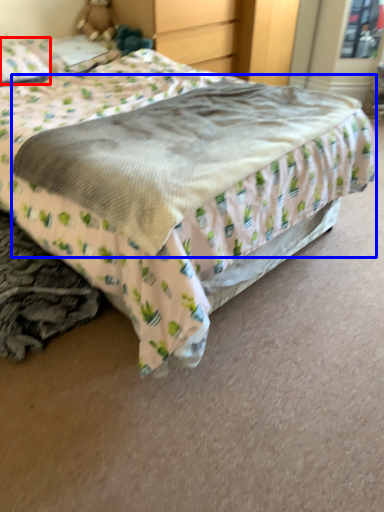
Question: Which of the following is the closest to the observer, pillow (highlighted by a red box) or mattress (highlighted by a blue box)?

Choices:
 (A) pillow
 (B) mattress

Answer: (B)